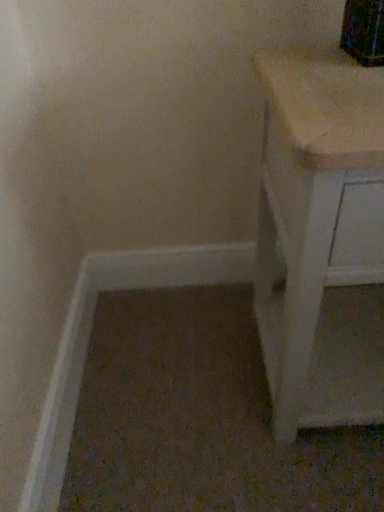
This screenshot has width=384, height=512. What do you see at coordinates (321, 239) in the screenshot?
I see `white wood chest of drawers at right` at bounding box center [321, 239].

The height and width of the screenshot is (512, 384). Identify the location of white wood chest of drawers at right. (321, 239).

Find the location of `white wood chest of drawers at right`. white wood chest of drawers at right is located at coordinates (321, 239).